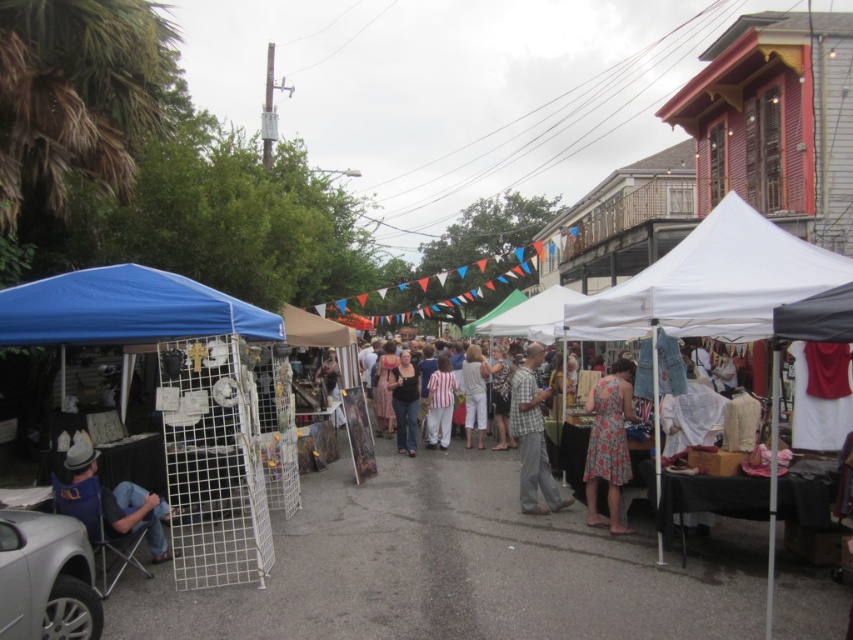
Does point (93, 273) come closer to viewer compared to point (410, 449)?

Yes, it is.

Which is in front, point (65, 305) or point (409, 381)?

Point (65, 305)

Does point (1, 342) come in front of point (401, 435)?

Yes.

Where is `blue fabric canopy at left`? blue fabric canopy at left is located at coordinates (125, 308).

Between white cotton pants at center and striped fabric pants at center, which one appears on the right side from the viewer's perspective?

white cotton pants at center

Who is positioned more to the left, white cotton pants at center or striped fabric pants at center?

Positioned to the left is striped fabric pants at center.

Where is `white cotton pants at center`? white cotton pants at center is located at coordinates (474, 392).

Does white fabric canopy at center have a lesser height compared to blue fabric canopy at left?

Correct, white fabric canopy at center is not as tall as blue fabric canopy at left.

Find the location of a particular element. white fabric canopy at center is located at coordinates (711, 282).

Who is more distant from viewer, (793, 278) or (65, 333)?

Point (793, 278)

Locate an element on the screen. white fabric canopy at center is located at coordinates (711, 282).